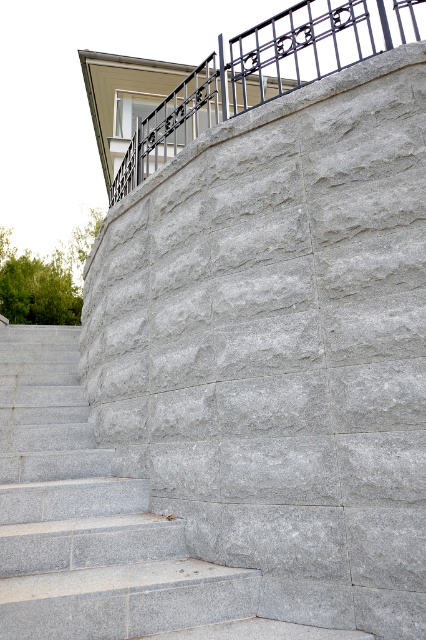
Question: Where is gray stone stairs at center located in relation to black wrought iron railing at upper center in the image?

Choices:
 (A) below
 (B) above

Answer: (A)

Question: Which object appears farthest from the camera in this image?

Choices:
 (A) gray stone stairs at center
 (B) black wrought iron railing at upper center

Answer: (B)

Question: Observing the image, what is the correct spatial positioning of gray stone stairs at center in reference to black wrought iron railing at upper center?

Choices:
 (A) left
 (B) right

Answer: (A)

Question: Which object is closer to the camera taking this photo?

Choices:
 (A) black wrought iron railing at upper center
 (B) gray stone stairs at center

Answer: (B)

Question: Does gray stone stairs at center appear under black wrought iron railing at upper center?

Choices:
 (A) no
 (B) yes

Answer: (B)

Question: Which object appears farthest from the camera in this image?

Choices:
 (A) gray stone stairs at center
 (B) black wrought iron railing at upper center

Answer: (B)